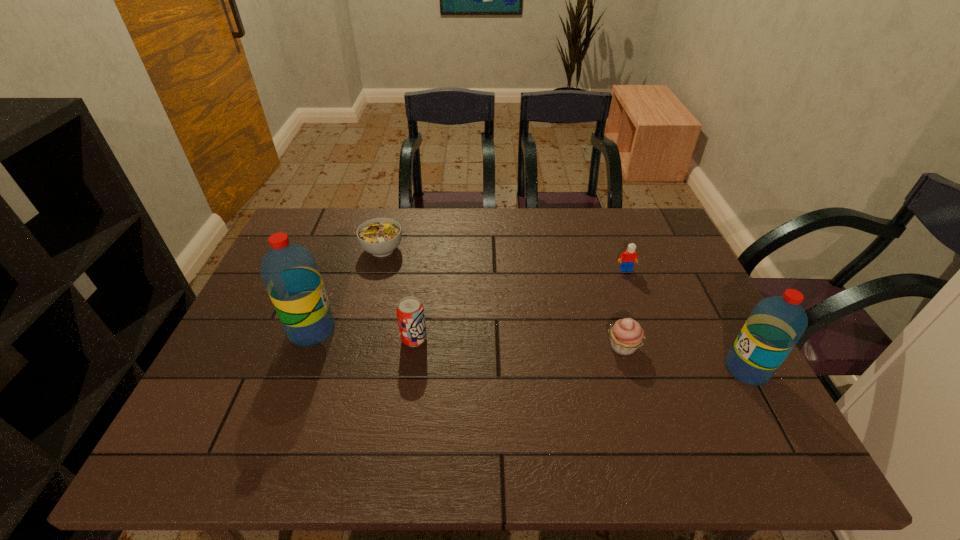
Identify which object is the fourth nearest to the soda can. Please provide its 2D coordinates. Your answer should be formatted as a tuple, i.e. [(x, y)], where the tuple contains the x and y coordinates of a point satisfying the conditions above.

[(627, 259)]

Select which object is the third closest to the left water bottle. Please provide its 2D coordinates. Your answer should be formatted as a tuple, i.e. [(x, y)], where the tuple contains the x and y coordinates of a point satisfying the conditions above.

[(626, 335)]

Find the location of a particular element. This screenshot has height=540, width=960. vacant point that satisfies the following two spatial constraints: 1. on the front side of the farthest object; 2. on the right side of the cupcake is located at coordinates (357, 347).

Where is `free spot that satisfies the following two spatial constraints: 1. on the front label of the left water bottle; 2. on the right side of the third tallest object`? free spot that satisfies the following two spatial constraints: 1. on the front label of the left water bottle; 2. on the right side of the third tallest object is located at coordinates (309, 339).

Where is `vacant area in the image that satisfies the following two spatial constraints: 1. on the back side of the third object from right to left; 2. on the front label of the tallest object`? vacant area in the image that satisfies the following two spatial constraints: 1. on the back side of the third object from right to left; 2. on the front label of the tallest object is located at coordinates (617, 330).

Find the location of a particular element. The height and width of the screenshot is (540, 960). free space that satisfies the following two spatial constraints: 1. on the front label of the farther water bottle; 2. on the back side of the fourth object from right to left is located at coordinates (309, 339).

What are the coordinates of `free point that satisfies the following two spatial constraints: 1. on the back side of the fourth object from left to right; 2. on the front label of the farther water bottle` in the screenshot? It's located at (617, 330).

Locate an element on the screen. vacant space that satisfies the following two spatial constraints: 1. on the front label of the third object from right to left; 2. on the right side of the taller water bottle is located at coordinates (306, 347).